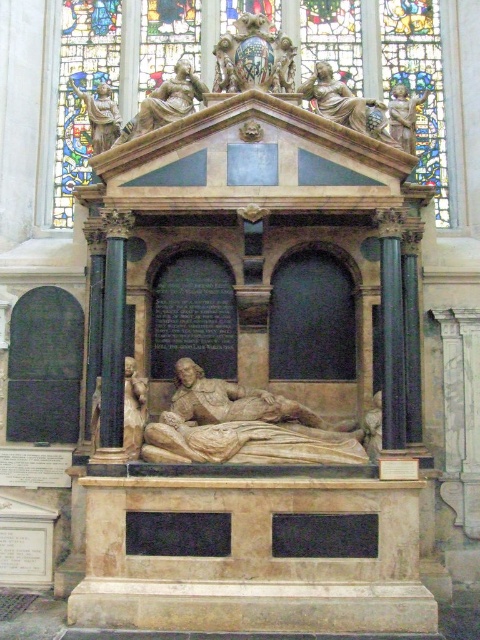
Question: Can you confirm if polished marble statue at center is thinner than matte stone cherub at upper right?

Choices:
 (A) no
 (B) yes

Answer: (A)

Question: Is stained glass window at upper center bigger than light brown stone figure at center?

Choices:
 (A) no
 (B) yes

Answer: (B)

Question: Among these points, which one is farthest from the camera?

Choices:
 (A) (352, 116)
 (B) (129, 442)
 (C) (177, 118)
 (D) (113, 273)

Answer: (C)

Question: Considering the real-world distances, which object is farthest from the black marble column at left?

Choices:
 (A) matte stone cherub at upper right
 (B) polished marble statue at upper left
 (C) polished marble coat of arms at upper center
 (D) bronze statue at upper center

Answer: (A)

Question: Is polished marble coat of arms at upper center above matte stone cherub at upper right?

Choices:
 (A) yes
 (B) no

Answer: (A)

Question: Which point is closer to the camera?

Choices:
 (A) (100, 401)
 (B) (124, 129)
 (C) (301, 10)

Answer: (A)